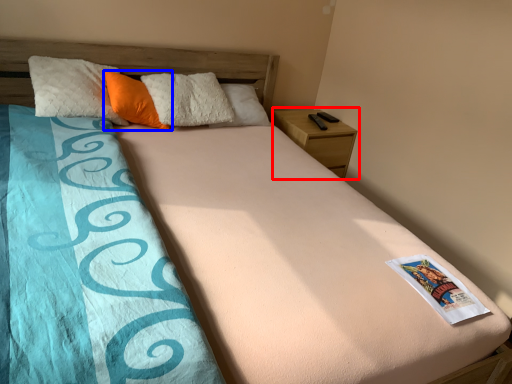
Question: Among these objects, which one is nearest to the camera, nightstand (highlighted by a red box) or pillow (highlighted by a blue box)?

Choices:
 (A) nightstand
 (B) pillow

Answer: (B)